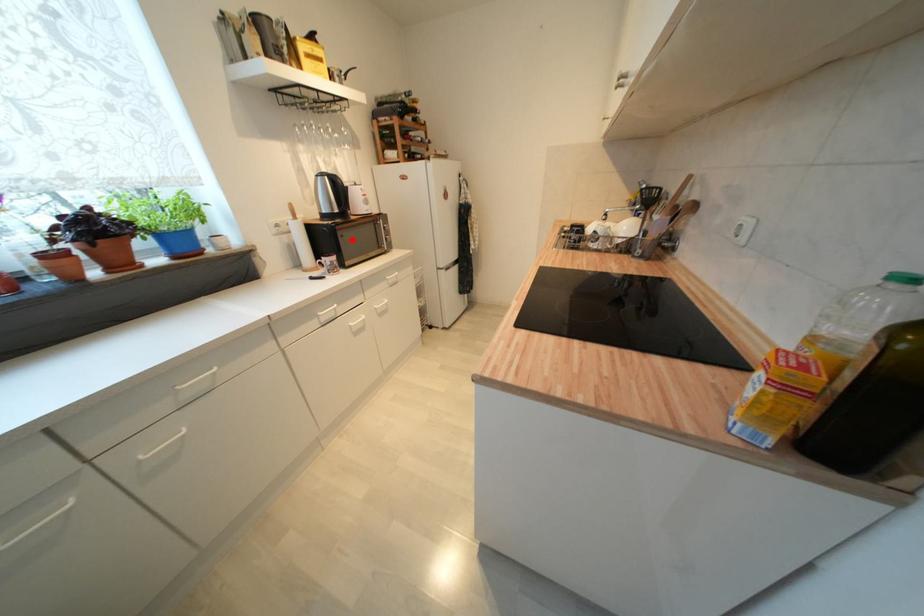
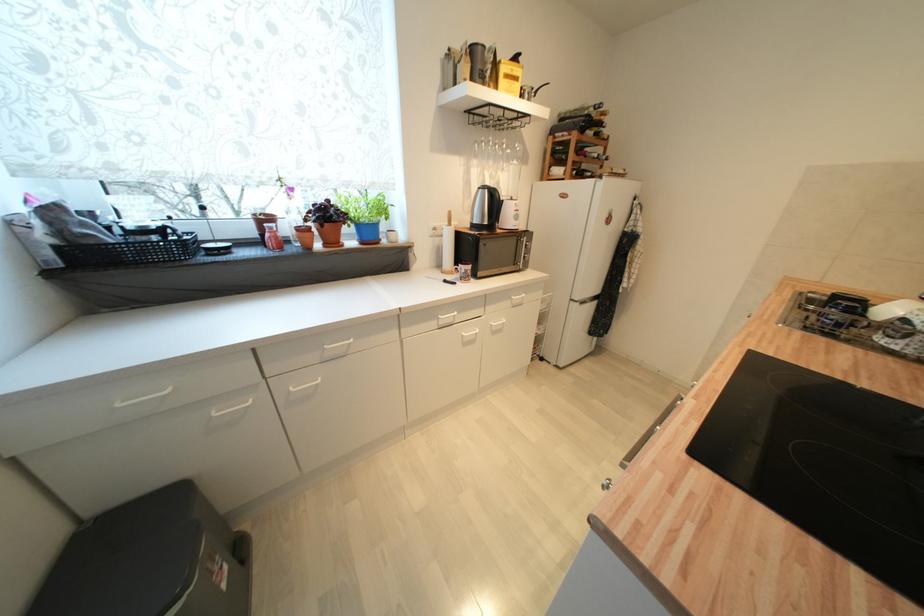
Locate, in the second image, the point that corresponds to the highlighted location in the first image.

(492, 251)